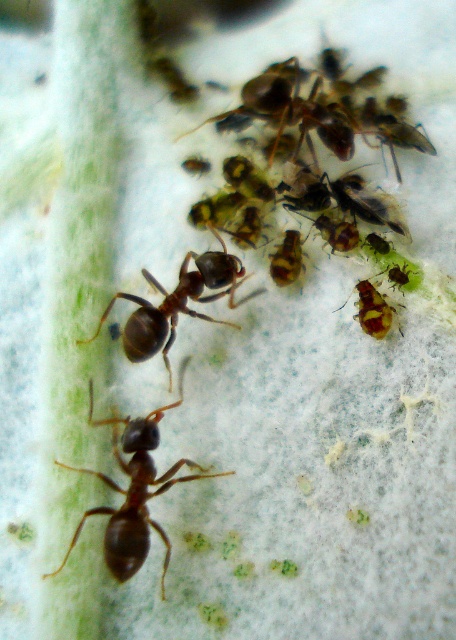
The image size is (456, 640). I want to click on shiny brown ant at center, so click(177, 304).

Is shiny brown ant at center above yellow-green glossy ant at center-right?

Indeed, shiny brown ant at center is positioned over yellow-green glossy ant at center-right.

Does point (155, 346) come behind point (377, 294)?

That is False.

Find the location of `shiny brown ant at center`. shiny brown ant at center is located at coordinates (177, 304).

Who is more distant from viewer, (104, 557) or (171, 333)?

The point (171, 333) is behind.

Is brown matte ant at center above shiny brown ant at center?

No, brown matte ant at center is not above shiny brown ant at center.

Is point (141, 516) behind point (149, 304)?

No, (141, 516) is in front of (149, 304).

Image resolution: width=456 pixels, height=640 pixels. What are the coordinates of `brown matte ant at center` in the screenshot? It's located at (134, 492).

Can you confirm if brown matte ant at center is shorter than yellow-green glossy ant at center-right?

No.

At what (x,y) coordinates should I click in order to perform the action: click on brown matte ant at center. Please return your answer as a coordinate pair (x, y). The height and width of the screenshot is (640, 456). Looking at the image, I should click on (134, 492).